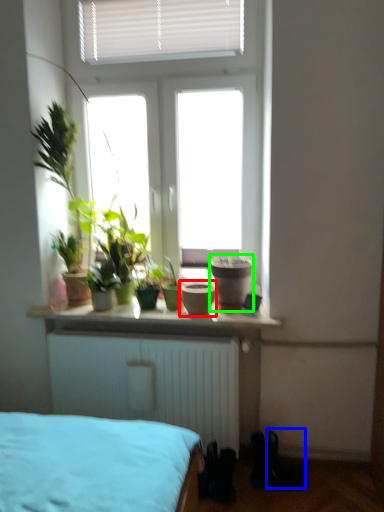
Question: Estimate the real-world distances between objects in this image. Which object is closer to flowerpot (highlighted by a red box), shoe (highlighted by a blue box) or flowerpot (highlighted by a green box)?

Choices:
 (A) shoe
 (B) flowerpot

Answer: (B)